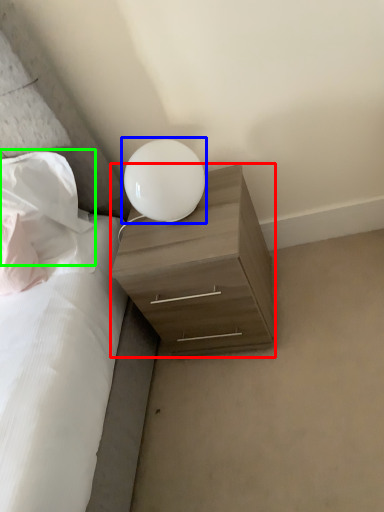
Question: Based on their relative distances, which object is nearer to nightstand (highlighted by a red box)? Choose from lamp (highlighted by a blue box) and pillow (highlighted by a green box).

Choices:
 (A) lamp
 (B) pillow

Answer: (A)